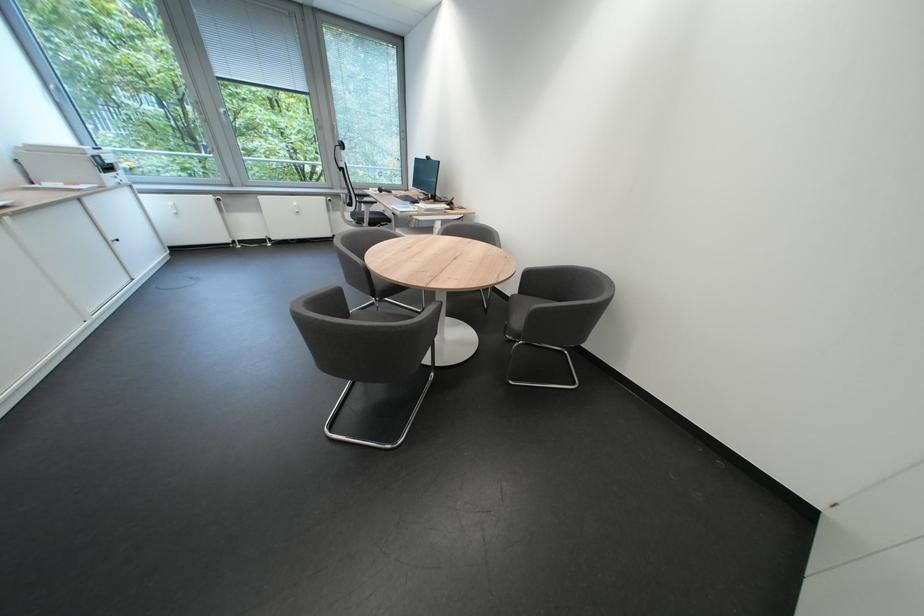
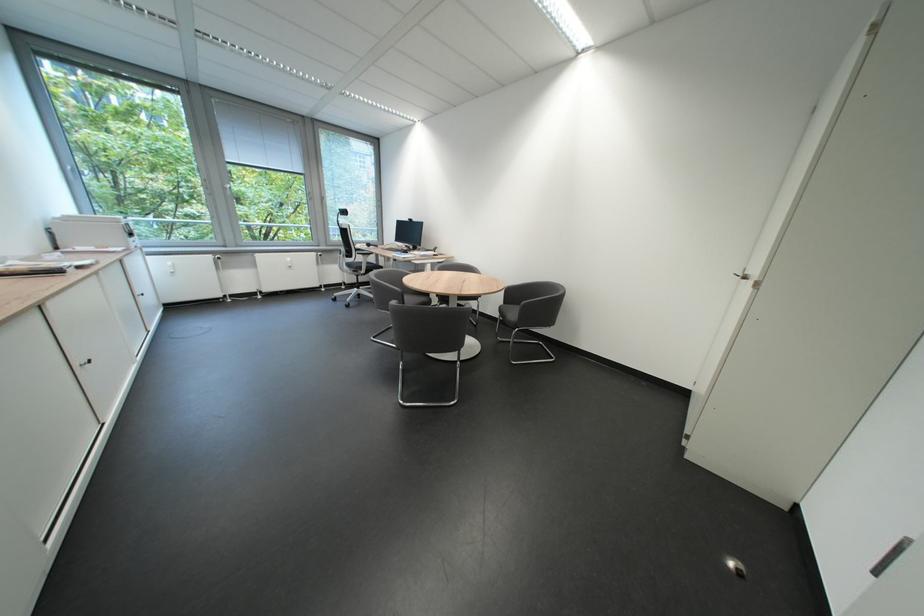
In a continuous first-person perspective shot, in which direction is the camera moving?

The cameraman moved toward left, backward.